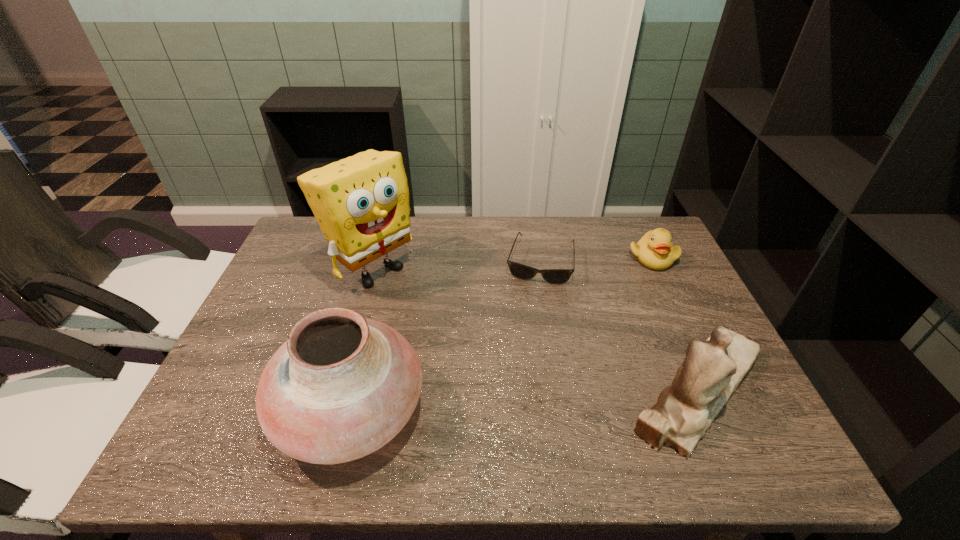
Where is `vacant space at the left edge`? The height and width of the screenshot is (540, 960). vacant space at the left edge is located at coordinates (313, 297).

Locate an element on the screen. This screenshot has width=960, height=540. vacant space at the far left corner of the desktop is located at coordinates (321, 230).

Find the location of `vacant space at the far right corner`. vacant space at the far right corner is located at coordinates (616, 216).

I want to click on vacant area that lies between the pottery and the third shortest object, so click(x=524, y=400).

Find the location of `vacant point located between the tallest object and the shortest object`. vacant point located between the tallest object and the shortest object is located at coordinates (456, 265).

The image size is (960, 540). Find the location of `free space that is in between the sunglasses and the pottery`. free space that is in between the sunglasses and the pottery is located at coordinates (445, 336).

What are the coordinates of `empty location between the fourth tallest object and the third object from left to right` in the screenshot? It's located at (596, 259).

The width and height of the screenshot is (960, 540). Find the location of `vacant area between the sunglasses and the duckling`. vacant area between the sunglasses and the duckling is located at coordinates (596, 259).

Where is `vacant area between the sunglasses and the sponge`? This screenshot has width=960, height=540. vacant area between the sunglasses and the sponge is located at coordinates (456, 265).

Locate an element on the screen. This screenshot has width=960, height=540. empty location between the third tallest object and the fourth shortest object is located at coordinates (524, 400).